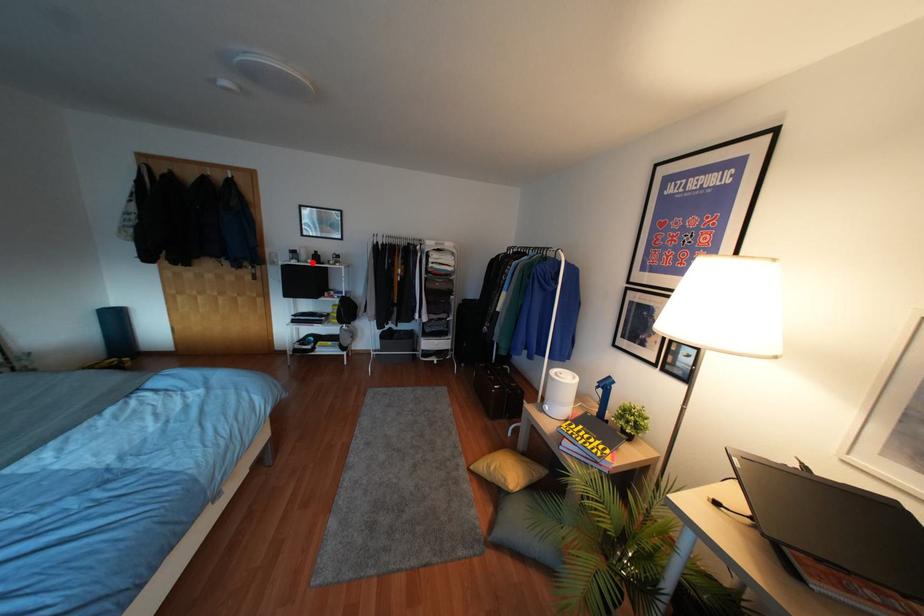
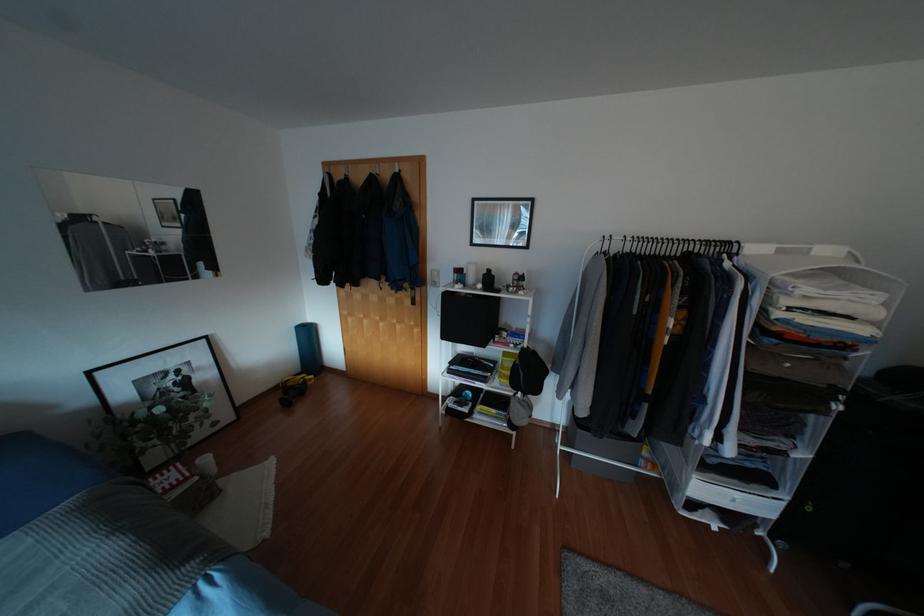
Find the pixel in the second image that matches the highlighted location in the first image.

(483, 289)